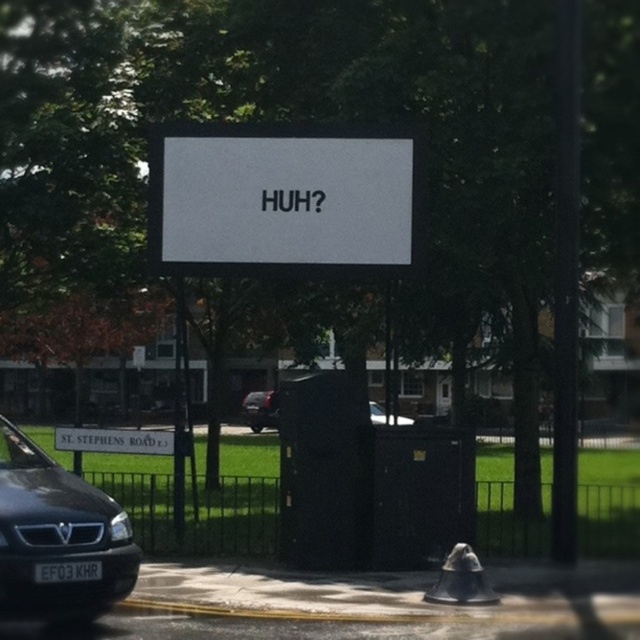
You are a parking attendant who needs to fit a car into a parking space that is 2 meters wide. You see both the shiny black car at center and the black matte car at center. Which car should you choose to park in this space?

The shiny black car at center has a lesser width compared to the black matte car at center, so it is more likely to fit in the 2 meter wide parking space.

You are a delivery driver who needs to pass through the street where the white matte sign at center and the matte black van at lower left are located. The van is blocking part of the road. Can you safely navigate around the van without hitting the sign?

The white matte sign at center might be wider than the matte black van at lower left, so there could be a risk of collision if you try to navigate around the van. It is safer to wait until the van moves or find an alternative route to avoid hitting the sign.